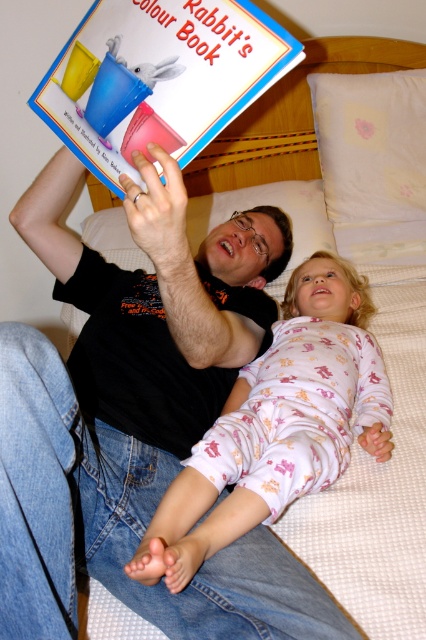
Question: Can you confirm if white cotton pajamas at center is positioned below hardcover book at upper center?

Choices:
 (A) yes
 (B) no

Answer: (A)

Question: Which point is closer to the camera?

Choices:
 (A) (204, 227)
 (B) (275, 429)

Answer: (B)

Question: Which of the following is the closest to the observer?

Choices:
 (A) white cotton pajamas at center
 (B) white soft pillow at upper center
 (C) hardcover book at upper center
 (D) white soft pillow at upper right

Answer: (A)

Question: Is white soft pillow at upper right closer to camera compared to white soft pillow at upper center?

Choices:
 (A) no
 (B) yes

Answer: (A)

Question: Among these objects, which one is farthest from the camera?

Choices:
 (A) hardcover book at upper center
 (B) white soft pillow at upper right
 (C) white soft pillow at upper center
 (D) white cotton pajamas at center

Answer: (B)

Question: Does hardcover book at upper center have a greater width compared to white soft pillow at upper center?

Choices:
 (A) yes
 (B) no

Answer: (B)